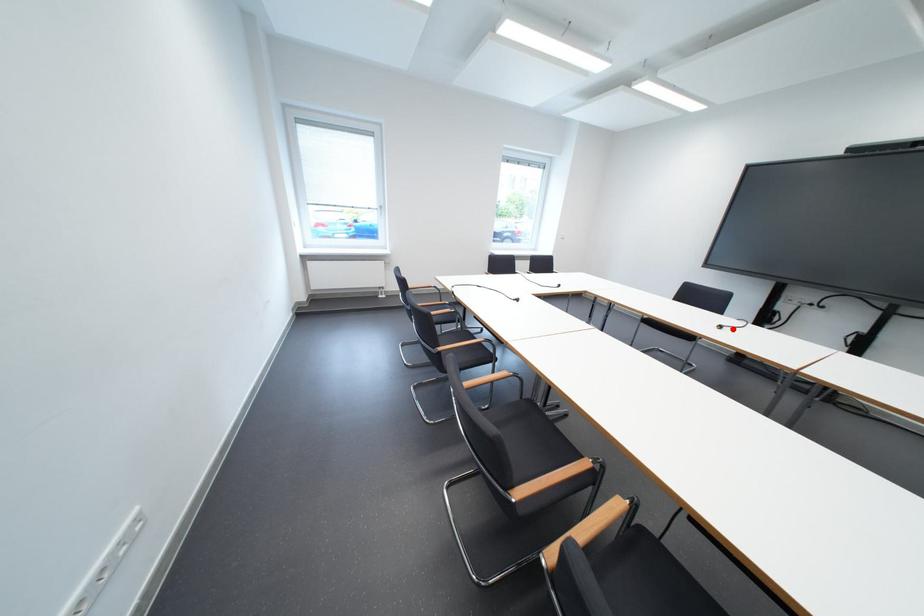
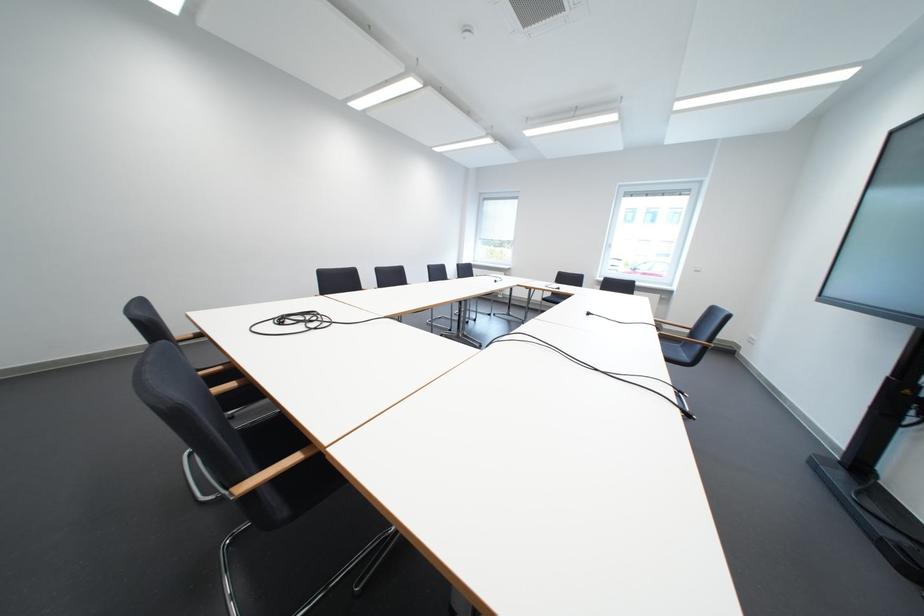
Question: A red point is marked in image1. In image2, is the corresponding 3D point closer to the camera or farther? Reply with the corresponding letter.

Choices:
 (A) The corresponding 3D point is closer.
 (B) The corresponding 3D point is farther.

Answer: (A)